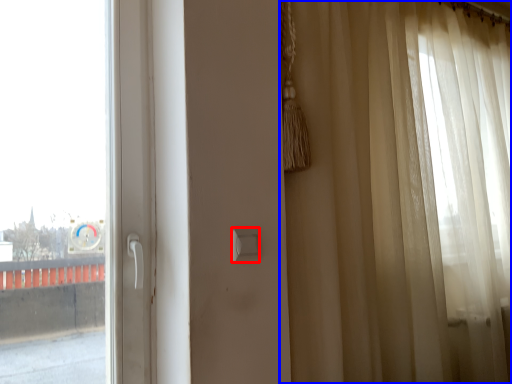
Question: Which object appears farthest to the camera in this image, light switch (highlighted by a red box) or curtain (highlighted by a blue box)?

Choices:
 (A) light switch
 (B) curtain

Answer: (A)